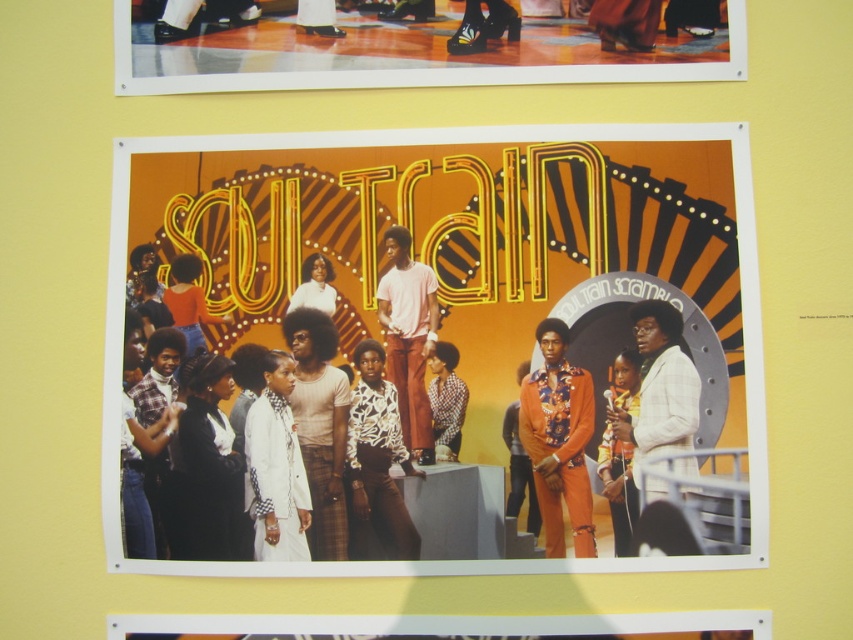
You are standing in front of the poster and want to touch both points on the poster. Which point would you need to reach out further to touch, point at (225, 556) or point at (184, 259)?

Point at (184, 259) is further from the camera than point at (225, 556), so you would need to reach out further to touch point at (184, 259).